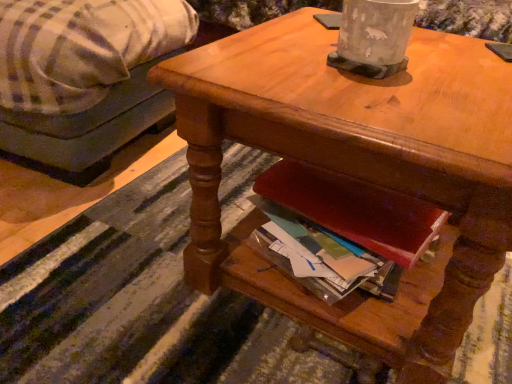
Question: Considering their positions, is wooden desk at center located in front of or behind plaid fabric couch at left?

Choices:
 (A) behind
 (B) front

Answer: (B)

Question: From a real-world perspective, is wooden desk at center physically located above or below plaid fabric couch at left?

Choices:
 (A) above
 (B) below

Answer: (A)

Question: Is wooden desk at center taller or shorter than plaid fabric couch at left?

Choices:
 (A) short
 (B) tall

Answer: (A)

Question: In the image, is plaid fabric couch at left on the left side or the right side of wooden desk at center?

Choices:
 (A) right
 (B) left

Answer: (B)

Question: Considering the positions of plaid fabric couch at left and wooden desk at center in the image, is plaid fabric couch at left wider or thinner than wooden desk at center?

Choices:
 (A) wide
 (B) thin

Answer: (A)

Question: Does point (x=172, y=34) appear closer or farther from the camera than point (x=432, y=182)?

Choices:
 (A) closer
 (B) farther

Answer: (B)

Question: From the image's perspective, is plaid fabric couch at left positioned above or below wooden desk at center?

Choices:
 (A) above
 (B) below

Answer: (A)